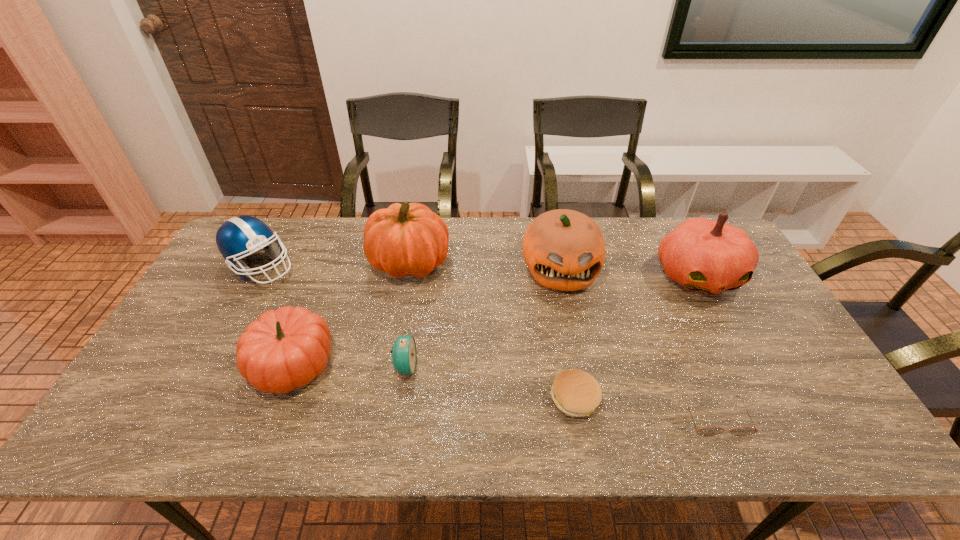
I want to click on object that is at the right edge, so [703, 255].

Where is `object that is positioned at the far left corner`? This screenshot has height=540, width=960. object that is positioned at the far left corner is located at coordinates (238, 237).

The image size is (960, 540). What are the coordinates of `object present at the far right corner` in the screenshot? It's located at (703, 255).

Find the location of a particular element. This screenshot has width=960, height=540. blank space at the far edge of the desktop is located at coordinates (310, 237).

In order to click on vacant space at the near edge in this screenshot , I will do `click(753, 444)`.

The width and height of the screenshot is (960, 540). I want to click on vacant space at the right edge, so click(x=769, y=401).

In the image, there is a desktop. At what (x,y) coordinates should I click in order to perform the action: click on free space at the near right corner. Please return your answer as a coordinate pair (x, y). Image resolution: width=960 pixels, height=540 pixels. Looking at the image, I should click on (783, 418).

Identify the location of free space between the third pumpkin from left to right and the patty. click(567, 334).

Find the location of a particular element. Image resolution: width=960 pixels, height=540 pixels. free spot between the patty and the third pumpkin from left to right is located at coordinates (567, 334).

Where is `free space between the shortest object and the second pumpkin from left to right`? This screenshot has width=960, height=540. free space between the shortest object and the second pumpkin from left to right is located at coordinates (563, 340).